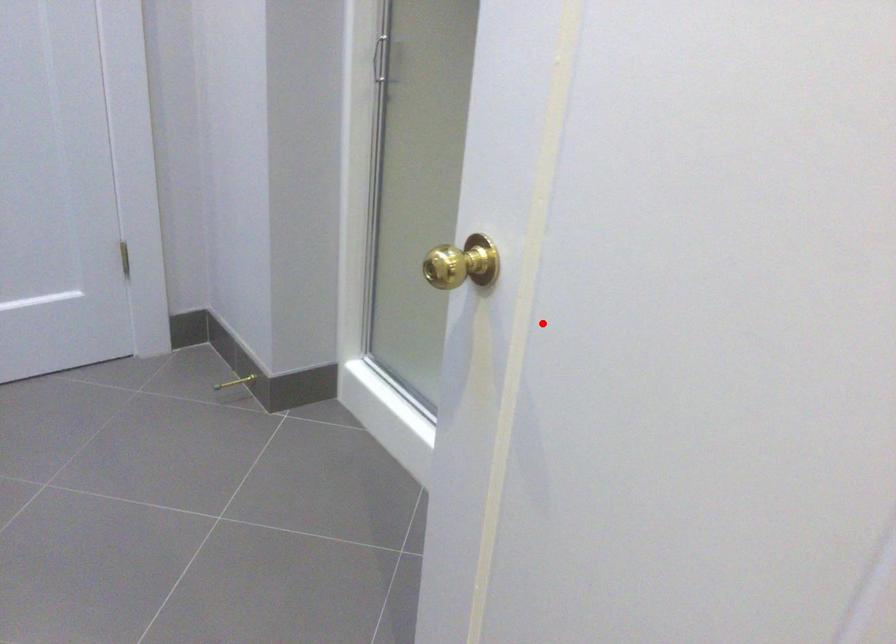
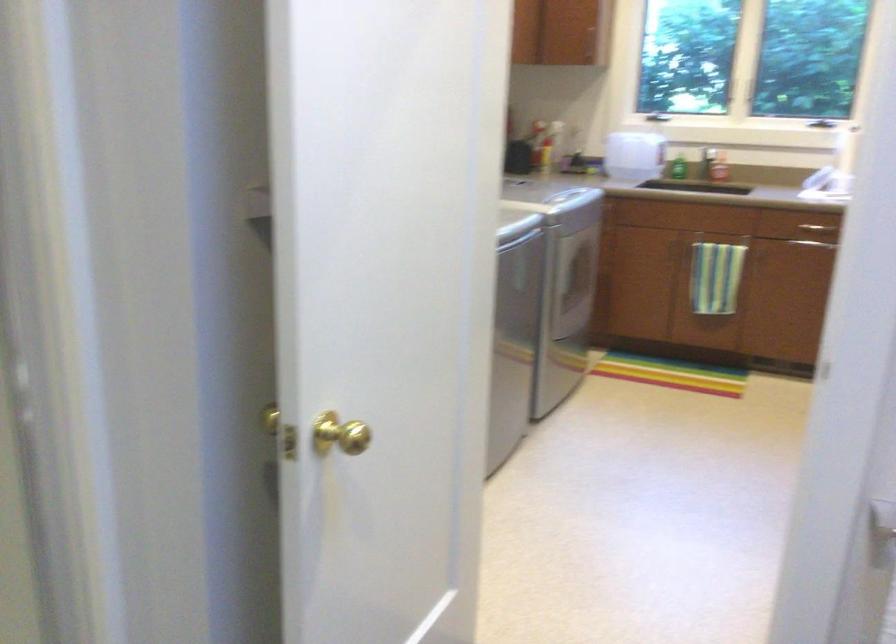
Question: I am providing you with two images of the same scene from different viewpoints. A red point is shown in image1. For the corresponding object point in image2, is it positioned nearer or farther from the camera?

Choices:
 (A) Nearer
 (B) Farther

Answer: (B)